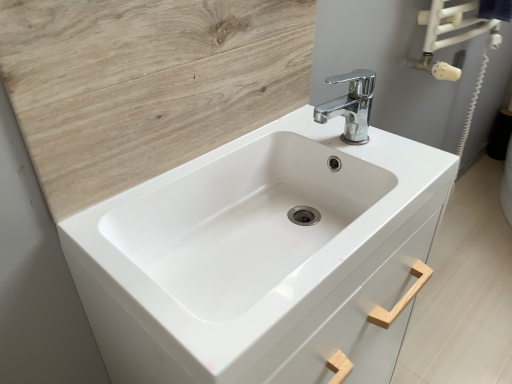
Question: From the image's perspective, relative to chrome metallic faucet at upper center, is white wood drawer at center above or below?

Choices:
 (A) below
 (B) above

Answer: (A)

Question: Do you think white wood drawer at center is within chrome metallic faucet at upper center, or outside of it?

Choices:
 (A) inside
 (B) outside

Answer: (B)

Question: Based on their relative distances, which object is farther from the wooden at upper left?

Choices:
 (A) white glossy sink at center
 (B) chrome metallic faucet at upper center
 (C) white wood drawer at center

Answer: (C)

Question: Based on their relative distances, which object is farther from the chrome metallic faucet at upper center?

Choices:
 (A) wooden at upper left
 (B) white glossy sink at center
 (C) white wood drawer at center

Answer: (C)